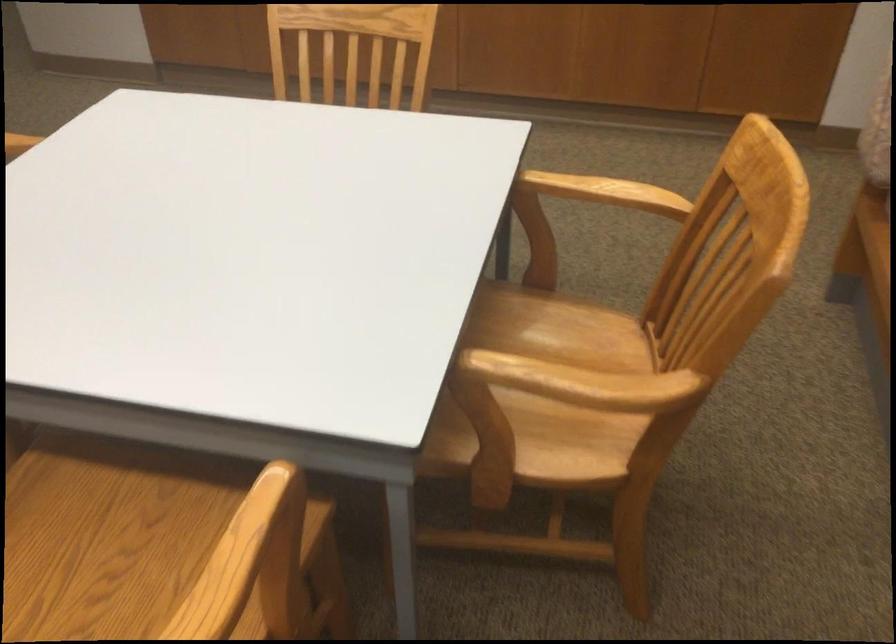
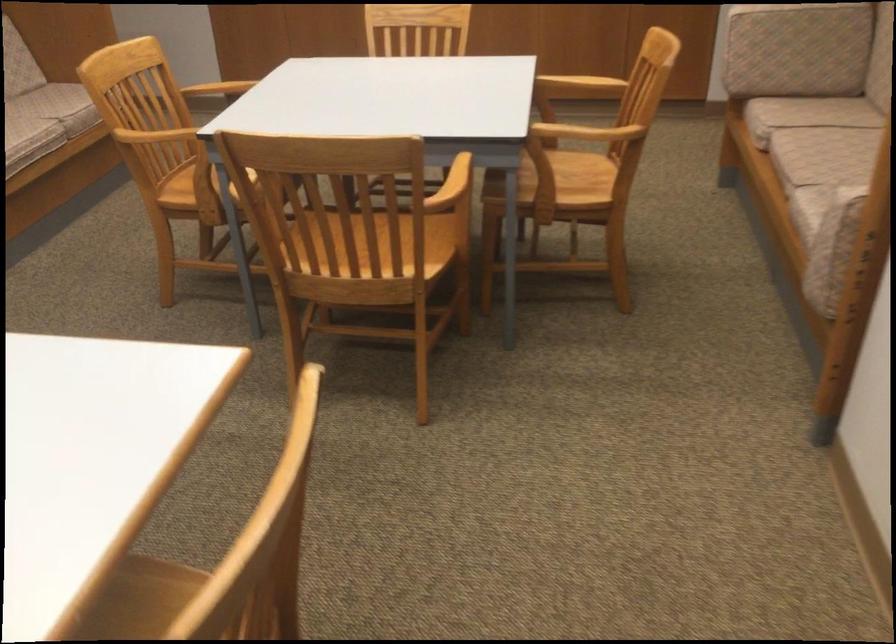
The point at (x=276, y=574) is marked in the first image. Where is the corresponding point in the second image?

(470, 174)